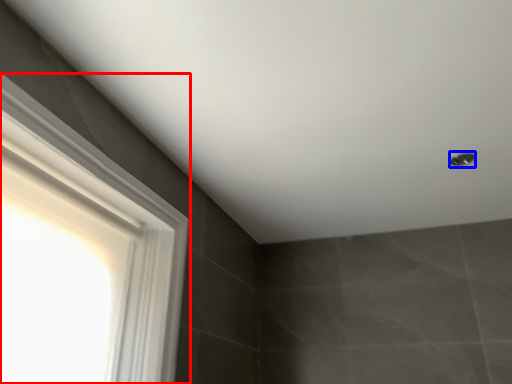
Question: Which point is closer to the camera, window (highlighted by a red box) or shower (highlighted by a blue box)?

Choices:
 (A) window
 (B) shower

Answer: (A)